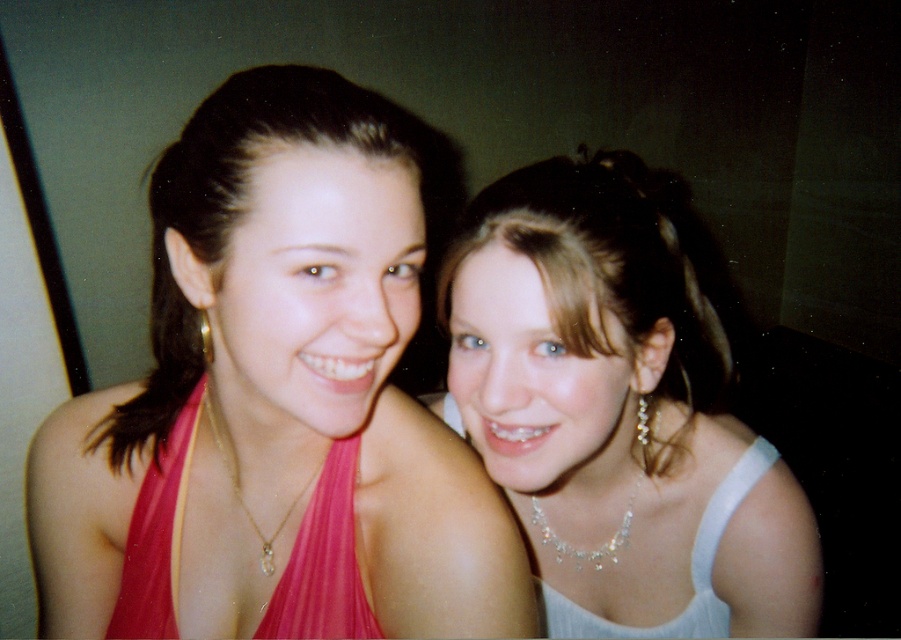
Question: Does pearl necklace at upper right have a smaller size compared to white satin dress at right?

Choices:
 (A) yes
 (B) no

Answer: (B)

Question: Is pink satin halter top at left thinner than pearl necklace at upper right?

Choices:
 (A) yes
 (B) no

Answer: (B)

Question: Does pink satin dress at center have a smaller size compared to white satin dress at right?

Choices:
 (A) yes
 (B) no

Answer: (A)

Question: Which object is the farthest from the pearl necklace at upper right?

Choices:
 (A) pink satin dress at center
 (B) pink satin halter top at left

Answer: (A)

Question: Which of the following is the farthest from the observer?

Choices:
 (A) pearl necklace at upper right
 (B) pink satin halter top at left
 (C) pink satin dress at center
 (D) white satin dress at right

Answer: (D)

Question: Which of the following is the farthest from the observer?

Choices:
 (A) (413, 300)
 (B) (317, 547)

Answer: (B)